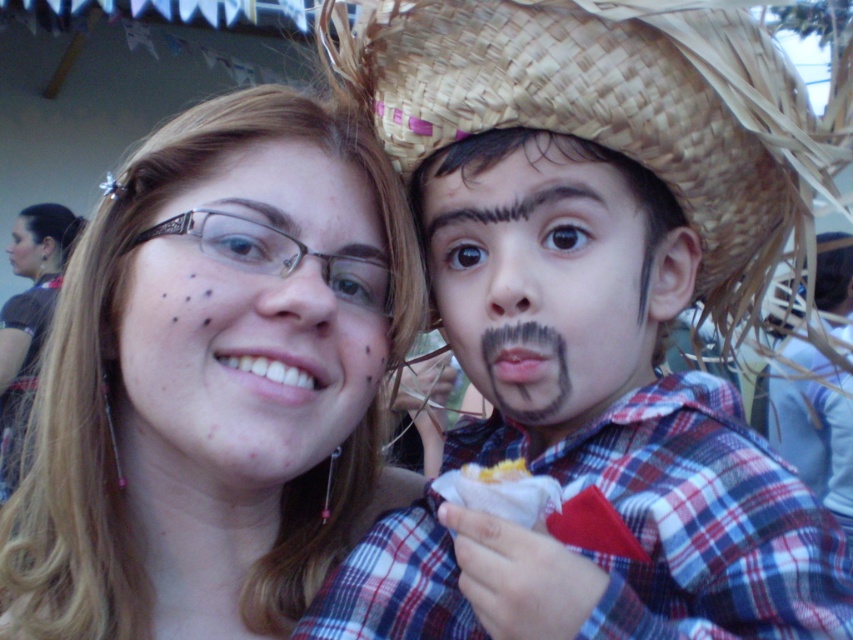
Question: Does brown woven straw cowboy hat at right appear over clear plastic glasses at center?

Choices:
 (A) no
 (B) yes

Answer: (B)

Question: Which object is the closest to the clear plastic glasses at center?

Choices:
 (A) plaid fabric shirt at center
 (B) brown woven straw cowboy hat at right
 (C) black matte mustache at center

Answer: (C)

Question: Does matte black hair at upper left have a larger size compared to smooth skin with freckles at center?

Choices:
 (A) no
 (B) yes

Answer: (B)

Question: Which object appears farthest from the camera in this image?

Choices:
 (A) matte black hair at upper left
 (B) plaid fabric shirt at center
 (C) smooth skin face at center

Answer: (C)

Question: Can you confirm if brown woven straw cowboy hat at right is positioned to the right of yellow crumbly food at lower center?

Choices:
 (A) yes
 (B) no

Answer: (A)

Question: Which point appears farthest from the camera in this image?

Choices:
 (A) (515, 458)
 (B) (35, 252)
 (C) (566, 100)
 (D) (27, 340)

Answer: (B)